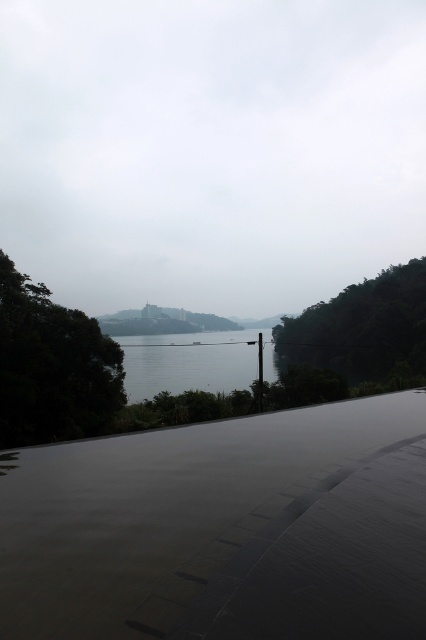
Which is behind, point (89, 426) or point (258, 387)?

The point (258, 387) is behind.

Is green leafy tree at left closer to the viewer compared to smooth metallic pole at center?

Yes.

What do you see at coordinates (51, 365) in the screenshot? This screenshot has width=426, height=640. I see `green leafy tree at left` at bounding box center [51, 365].

You are a GUI agent. You are given a task and a screenshot of the screen. Output one action in this format:
    pyautogui.click(x=<x>, y=<y>)
    Task: Click on the green leafy tree at left
    This screenshot has width=426, height=640.
    Given the screenshot: What is the action you would take?
    pyautogui.click(x=51, y=365)

Between point (106, 381) and point (356, 323), which one is positioned behind?

The point (356, 323) is behind.

Who is positioned more to the left, green leafy tree at left or green matte tree at right?

green leafy tree at left

Does point (94, 397) come farther from viewer compared to point (290, 323)?

No, (94, 397) is closer to viewer.

Image resolution: width=426 pixels, height=640 pixels. I want to click on green leafy tree at left, so click(51, 365).

Who is positioned more to the right, clear water at center or smooth metallic pole at center?

Positioned to the right is smooth metallic pole at center.

Who is lower down, clear water at center or smooth metallic pole at center?

clear water at center

Between point (178, 349) and point (261, 397), which one is positioned behind?

The point (178, 349) is more distant.

Identify the location of clear water at center. (187, 362).